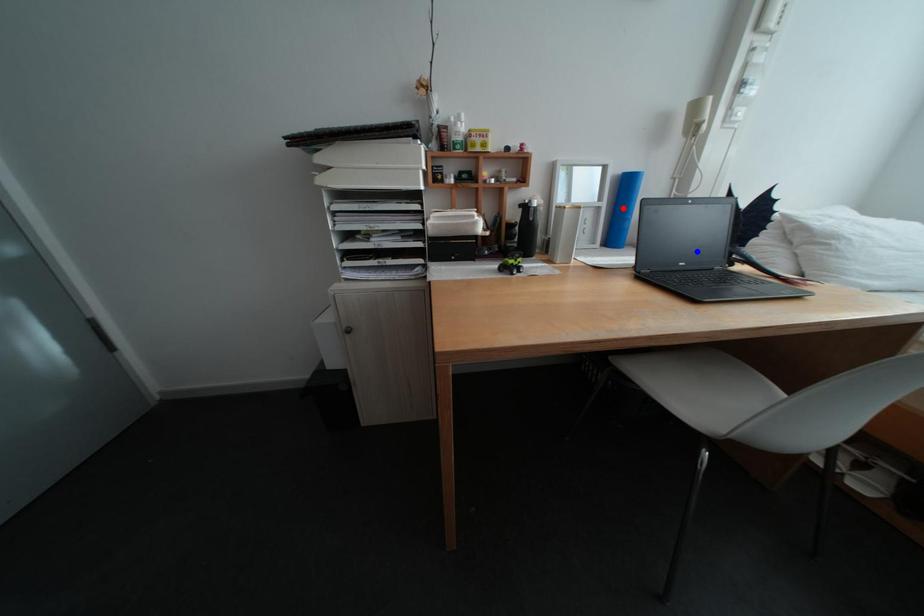
Question: Two points are marked on the image. Which point is closer to the camera?

Choices:
 (A) Blue point is closer.
 (B) Red point is closer.

Answer: (A)